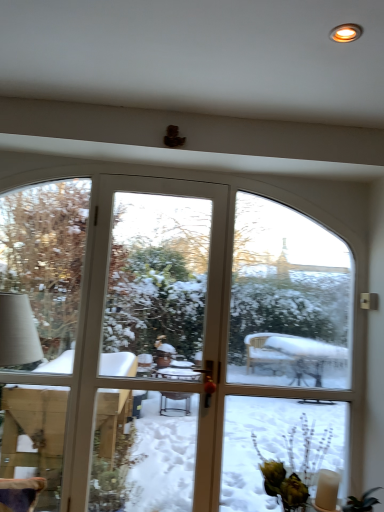
Question: Based on their sizes in the image, would you say clear glass screen door at center is bigger or smaller than green leafy plant at lower right?

Choices:
 (A) big
 (B) small

Answer: (B)

Question: Considering the positions of point (246, 210) and point (302, 501), is point (246, 210) closer or farther from the camera than point (302, 501)?

Choices:
 (A) farther
 (B) closer

Answer: (A)

Question: Which object is the closest to the green leafy plant at lower right?

Choices:
 (A) matte gold light at upper right
 (B) clear glass screen door at center

Answer: (B)

Question: Estimate the real-world distances between objects in this image. Which object is farther from the green leafy plant at lower right?

Choices:
 (A) matte gold light at upper right
 (B) clear glass screen door at center

Answer: (A)